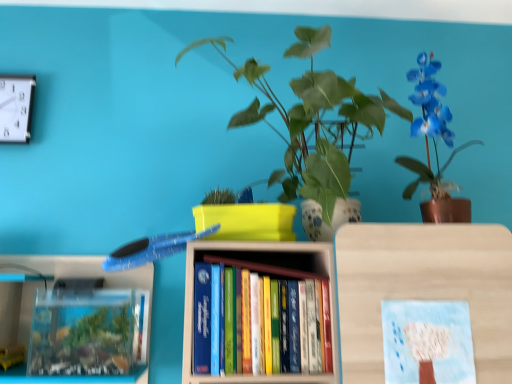
Question: Is the position of white plastic clock at upper left less distant than that of green leafy plant at upper center?

Choices:
 (A) no
 (B) yes

Answer: (A)

Question: Does white plastic clock at upper left have a greater height compared to green leafy plant at upper center?

Choices:
 (A) yes
 (B) no

Answer: (B)

Question: Can we say white plastic clock at upper left lies outside green leafy plant at upper center?

Choices:
 (A) no
 (B) yes

Answer: (B)

Question: Can you confirm if white plastic clock at upper left is wider than green leafy plant at upper center?

Choices:
 (A) yes
 (B) no

Answer: (B)

Question: From the image's perspective, is white plastic clock at upper left located above green leafy plant at upper center?

Choices:
 (A) no
 (B) yes

Answer: (B)

Question: Is white plastic clock at upper left shorter than green leafy plant at upper center?

Choices:
 (A) yes
 (B) no

Answer: (A)

Question: Considering the relative sizes of green leafy plant at upper center and white plastic clock at upper left in the image provided, is green leafy plant at upper center wider than white plastic clock at upper left?

Choices:
 (A) no
 (B) yes

Answer: (B)

Question: From the image's perspective, does green leafy plant at upper center appear lower than white plastic clock at upper left?

Choices:
 (A) yes
 (B) no

Answer: (A)

Question: Does green leafy plant at upper center lie behind white plastic clock at upper left?

Choices:
 (A) no
 (B) yes

Answer: (A)

Question: Can you confirm if green leafy plant at upper center is thinner than white plastic clock at upper left?

Choices:
 (A) yes
 (B) no

Answer: (B)

Question: Does green leafy plant at upper center appear on the left side of white plastic clock at upper left?

Choices:
 (A) no
 (B) yes

Answer: (A)

Question: Is green leafy plant at upper center facing towards white plastic clock at upper left?

Choices:
 (A) no
 (B) yes

Answer: (A)

Question: Is pastel blue paper at center thinner than blue glossy orchid at upper right?

Choices:
 (A) yes
 (B) no

Answer: (A)